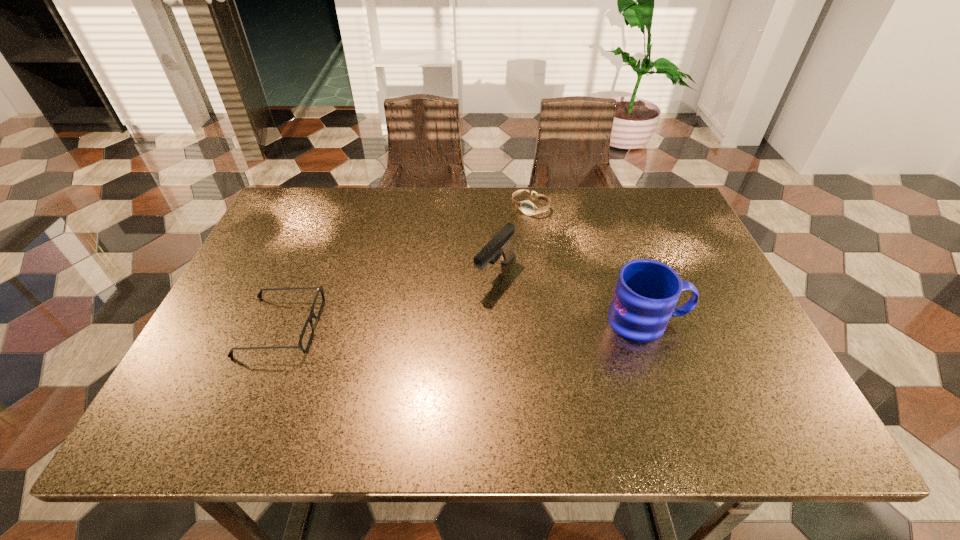
Where is `free spot that satisfies the following two spatial constraints: 1. on the front side of the tallest object; 2. on the side with the handle of the third shortest object`? This screenshot has height=540, width=960. free spot that satisfies the following two spatial constraints: 1. on the front side of the tallest object; 2. on the side with the handle of the third shortest object is located at coordinates (496, 321).